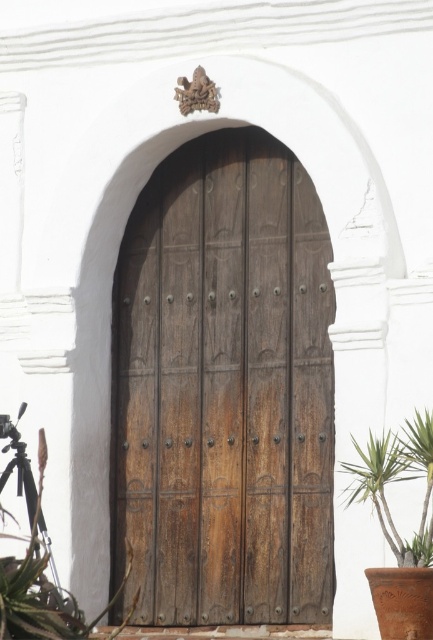
Question: Estimate the real-world distances between objects in this image. Which object is farther from the brown wooden door at center?

Choices:
 (A) green leafy plant at lower left
 (B) green leafy plant at lower right

Answer: (B)

Question: Does green leafy plant at lower left appear over green leafy plant at lower right?

Choices:
 (A) yes
 (B) no

Answer: (B)

Question: Which object is the farthest from the brown wooden door at center?

Choices:
 (A) green leafy plant at lower right
 (B) green leafy plant at lower left

Answer: (A)

Question: Which of the following is the closest to the observer?

Choices:
 (A) (116, 632)
 (B) (397, 458)
 (C) (287, 476)

Answer: (B)

Question: Does brown wooden door at center appear on the left side of green leafy plant at lower right?

Choices:
 (A) yes
 (B) no

Answer: (A)

Question: Is green leafy plant at lower left further to camera compared to green leafy plant at lower right?

Choices:
 (A) yes
 (B) no

Answer: (B)